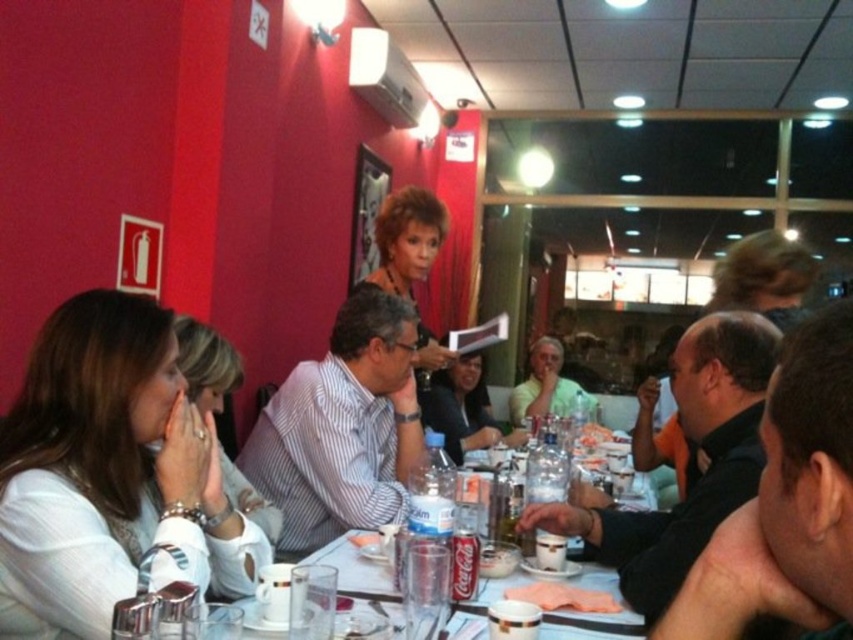
Question: Does black shirt at center appear on the left side of white striped shirt at center?

Choices:
 (A) no
 (B) yes

Answer: (A)

Question: Which point is farther to the camera?

Choices:
 (A) (405, 362)
 (B) (837, 628)

Answer: (A)

Question: Can you confirm if white matte shirt at left is wider than black glossy shirt at center?

Choices:
 (A) no
 (B) yes

Answer: (A)

Question: Which point is farther from the camera taking this photo?

Choices:
 (A) (103, 600)
 (B) (538, 355)

Answer: (B)

Question: Which object is closer to the camera taking this photo?

Choices:
 (A) light green shirt at center
 (B) white matte shirt at left
 (C) black glossy shirt at center

Answer: (B)

Question: Can you confirm if white matte shirt at left is positioned above white striped shirt at center?

Choices:
 (A) no
 (B) yes

Answer: (B)